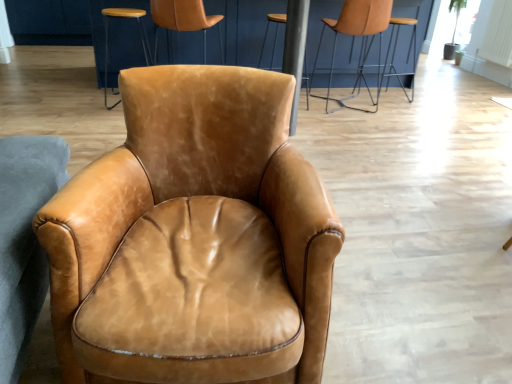
The width and height of the screenshot is (512, 384). What do you see at coordinates (108, 38) in the screenshot? I see `light brown leather stool at upper center` at bounding box center [108, 38].

What do you see at coordinates (184, 19) in the screenshot? I see `leather chair at upper center, which is the 1th chair in left-to-right order` at bounding box center [184, 19].

What is the approximate width of leather chair at upper center, which ranks as the 2th chair in front-to-back order?

55.63 centimeters.

Image resolution: width=512 pixels, height=384 pixels. What do you see at coordinates (353, 38) in the screenshot?
I see `leather tan chair at upper center, the 3th chair in the left-to-right sequence` at bounding box center [353, 38].

The width and height of the screenshot is (512, 384). I want to click on saddle brown leather armchair at center, which is the 3th chair in right-to-left order, so click(195, 236).

I want to click on leather armchair at upper right, the first chair viewed from the back, so click(394, 55).

Choose the correct answer: Is saddle brown leather armchair at center, the fourth chair viewed from the back, inside leather armchair at upper right, the 4th chair viewed from the left, or outside it?

saddle brown leather armchair at center, the fourth chair viewed from the back, lies outside leather armchair at upper right, the 4th chair viewed from the left.

How many degrees apart are the facing directions of saddle brown leather armchair at center, the fourth chair viewed from the back, and leather armchair at upper right, the 4th chair viewed from the left?

There is a 164-degree angle between the facing directions of saddle brown leather armchair at center, the fourth chair viewed from the back, and leather armchair at upper right, the 4th chair viewed from the left.

Does saddle brown leather armchair at center, the first chair positioned from the front, come in front of leather armchair at upper right, arranged as the fourth chair when viewed from the front?

Yes, saddle brown leather armchair at center, the first chair positioned from the front, is closer to the camera.

Locate an element on the screen. The image size is (512, 384). the 2nd chair to the left of the leather armchair at upper right, the 4th chair viewed from the left, counting from the anchor's position is located at coordinates (195, 236).

Does light brown leather stool at upper center have a greater width compared to saddle brown leather armchair at center, which is the 3th chair in right-to-left order?

No, light brown leather stool at upper center is not wider than saddle brown leather armchair at center, which is the 3th chair in right-to-left order.

Is saddle brown leather armchair at center, which is the 3th chair in right-to-left order, at the back of light brown leather stool at upper center?

Absolutely, light brown leather stool at upper center is directed away from saddle brown leather armchair at center, which is the 3th chair in right-to-left order.

Is light brown leather stool at upper center in front of saddle brown leather armchair at center, the first chair positioned from the front?

No, light brown leather stool at upper center is further to the viewer.

Is leather armchair at upper right, arranged as the fourth chair when viewed from the front, directly adjacent to light brown leather stool at upper center?

They are not placed beside each other.

In terms of width, does leather armchair at upper right, positioned as the first chair in right-to-left order, look wider or thinner when compared to light brown leather stool at upper center?

Considering their sizes, leather armchair at upper right, positioned as the first chair in right-to-left order, looks slimmer than light brown leather stool at upper center.

Considering the relative sizes of leather armchair at upper right, arranged as the fourth chair when viewed from the front, and light brown leather stool at upper center in the image provided, is leather armchair at upper right, arranged as the fourth chair when viewed from the front, taller than light brown leather stool at upper center?

Yes, leather armchair at upper right, arranged as the fourth chair when viewed from the front, is taller than light brown leather stool at upper center.

Could you tell me if leather armchair at upper right, positioned as the first chair in right-to-left order, is facing light brown leather stool at upper center?

No.

Considering the points (259, 66) and (416, 25), which point is in front, point (259, 66) or point (416, 25)?

The point (259, 66) is more forward.

Can you confirm if brown leather bar stool at center is taller than leather armchair at upper right, the first chair viewed from the back?

Yes.

Looking at this image, is brown leather bar stool at center behind leather armchair at upper right, positioned as the first chair in right-to-left order?

No, brown leather bar stool at center is closer to the camera.

Which chair is the 2nd one when counting from the right side of the brown leather bar stool at center? Please provide its 2D coordinates.

[(394, 55)]

From a real-world perspective, is leather tan chair at upper center, which is the second chair from back to front, over saddle brown leather armchair at center, the 2th chair in the left-to-right sequence?

Indeed, from a real-world perspective, leather tan chair at upper center, which is the second chair from back to front, stands above saddle brown leather armchair at center, the 2th chair in the left-to-right sequence.

Which object is wider, leather tan chair at upper center, the 3th chair in the left-to-right sequence, or saddle brown leather armchair at center, the fourth chair viewed from the back?

saddle brown leather armchair at center, the fourth chair viewed from the back.

Looking at this image, how many degrees apart are the facing directions of leather tan chair at upper center, which appears as the 2th chair when viewed from the right, and saddle brown leather armchair at center, the 2th chair in the left-to-right sequence?

171 degrees separate the facing orientations of leather tan chair at upper center, which appears as the 2th chair when viewed from the right, and saddle brown leather armchair at center, the 2th chair in the left-to-right sequence.

Which of these two, leather tan chair at upper center, which is the second chair from back to front, or saddle brown leather armchair at center, the first chair positioned from the front, stands taller?

leather tan chair at upper center, which is the second chair from back to front.

Considering the sizes of objects leather chair at upper center, which ranks as the 2th chair in front-to-back order, and brown leather bar stool at center in the image provided, who is taller, leather chair at upper center, which ranks as the 2th chair in front-to-back order, or brown leather bar stool at center?

With more height is brown leather bar stool at center.

Is leather chair at upper center, which is the 4th chair from right to left, positioned with its back to brown leather bar stool at center?

No, leather chair at upper center, which is the 4th chair from right to left,'s orientation is not away from brown leather bar stool at center.

Measure the distance from leather chair at upper center, which ranks as the 2th chair in front-to-back order, to brown leather bar stool at center.

The distance of leather chair at upper center, which ranks as the 2th chair in front-to-back order, from brown leather bar stool at center is 26.92 inches.

Find the location of a particular element. This screenshot has width=512, height=384. bar stool that appears below the leather chair at upper center, which ranks as the 2th chair in front-to-back order (from a real-world perspective) is located at coordinates (274, 37).

From a real-world perspective, is leather chair at upper center, which ranks as the 2th chair in front-to-back order, physically below light brown leather stool at upper center?

No, from a real-world perspective, leather chair at upper center, which ranks as the 2th chair in front-to-back order, is not under light brown leather stool at upper center.

Between leather chair at upper center, which is the 4th chair from right to left, and light brown leather stool at upper center, which one appears on the right side from the viewer's perspective?

Positioned to the right is leather chair at upper center, which is the 4th chair from right to left.

How many degrees apart are the facing directions of leather chair at upper center, which is the 1th chair in left-to-right order, and light brown leather stool at upper center?

The angular difference between leather chair at upper center, which is the 1th chair in left-to-right order, and light brown leather stool at upper center is 4.41 degrees.

Does point (205, 24) lie in front of point (141, 41)?

Yes, point (205, 24) is in front of point (141, 41).

This screenshot has width=512, height=384. There is a leather armchair at upper right, arranged as the fourth chair when viewed from the front. Find the location of `the 1st chair above it (from a real-world perspective)`. the 1st chair above it (from a real-world perspective) is located at coordinates (195, 236).

This screenshot has width=512, height=384. In order to click on stool behind the saddle brown leather armchair at center, the first chair positioned from the front in this screenshot , I will do `click(108, 38)`.

From the image, which object appears to be farther from leather armchair at upper right, the 4th chair viewed from the left, saddle brown leather armchair at center, the 2th chair in the left-to-right sequence, or brown leather bar stool at center?

saddle brown leather armchair at center, the 2th chair in the left-to-right sequence.

Which object lies nearer to the anchor point saddle brown leather armchair at center, the first chair positioned from the front, light brown leather stool at upper center or leather chair at upper center, positioned as the third chair in back-to-front order?

The object closer to saddle brown leather armchair at center, the first chair positioned from the front, is leather chair at upper center, positioned as the third chair in back-to-front order.

From the picture: When comparing their distances from leather armchair at upper right, the first chair viewed from the back, does leather tan chair at upper center, the 3th chair in the left-to-right sequence, or light brown leather stool at upper center seem further?

light brown leather stool at upper center lies further to leather armchair at upper right, the first chair viewed from the back, than the other object.

Consider the image. When comparing their distances from leather chair at upper center, which ranks as the 2th chair in front-to-back order, does light brown leather stool at upper center or leather armchair at upper right, the 4th chair viewed from the left, seem further?

Among the two, leather armchair at upper right, the 4th chair viewed from the left, is located further to leather chair at upper center, which ranks as the 2th chair in front-to-back order.

Considering their positions, is leather tan chair at upper center, the 3th chair in the left-to-right sequence, positioned closer to brown leather bar stool at center than leather armchair at upper right, positioned as the first chair in right-to-left order?

Among the two, leather tan chair at upper center, the 3th chair in the left-to-right sequence, is located nearer to brown leather bar stool at center.

Looking at the image, which one is located closer to leather armchair at upper right, the 4th chair viewed from the left, leather chair at upper center, which is the 4th chair from right to left, or brown leather bar stool at center?

Based on the image, brown leather bar stool at center appears to be nearer to leather armchair at upper right, the 4th chair viewed from the left.

When comparing their distances from leather armchair at upper right, positioned as the first chair in right-to-left order, does leather tan chair at upper center, which is the 3th chair from front to back, or leather chair at upper center, which is the 1th chair in left-to-right order, seem further?

Among the two, leather chair at upper center, which is the 1th chair in left-to-right order, is located further to leather armchair at upper right, positioned as the first chair in right-to-left order.

Consider the image. When comparing their distances from leather armchair at upper right, arranged as the fourth chair when viewed from the front, does light brown leather stool at upper center or leather tan chair at upper center, which is the 3th chair from front to back, seem further?

light brown leather stool at upper center lies further to leather armchair at upper right, arranged as the fourth chair when viewed from the front, than the other object.

Identify the location of stool between saddle brown leather armchair at center, the 2th chair in the left-to-right sequence, and leather tan chair at upper center, which appears as the 2th chair when viewed from the right, along the z-axis. This screenshot has width=512, height=384. (108, 38).

Where is `bar stool between light brown leather stool at upper center and leather tan chair at upper center, which is the 3th chair from front to back, in the horizontal direction`? The image size is (512, 384). bar stool between light brown leather stool at upper center and leather tan chair at upper center, which is the 3th chair from front to back, in the horizontal direction is located at coordinates tap(274, 37).

You are a GUI agent. You are given a task and a screenshot of the screen. Output one action in this format:
    pyautogui.click(x=<x>, y=<y>)
    Task: Click on the chair between saddle brown leather armchair at center, the fourth chair viewed from the back, and light brown leather stool at upper center in the front-back direction
    The width and height of the screenshot is (512, 384).
    Given the screenshot: What is the action you would take?
    pyautogui.click(x=184, y=19)

This screenshot has width=512, height=384. In order to click on stool between saddle brown leather armchair at center, the first chair positioned from the front, and brown leather bar stool at center from front to back in this screenshot , I will do `click(108, 38)`.